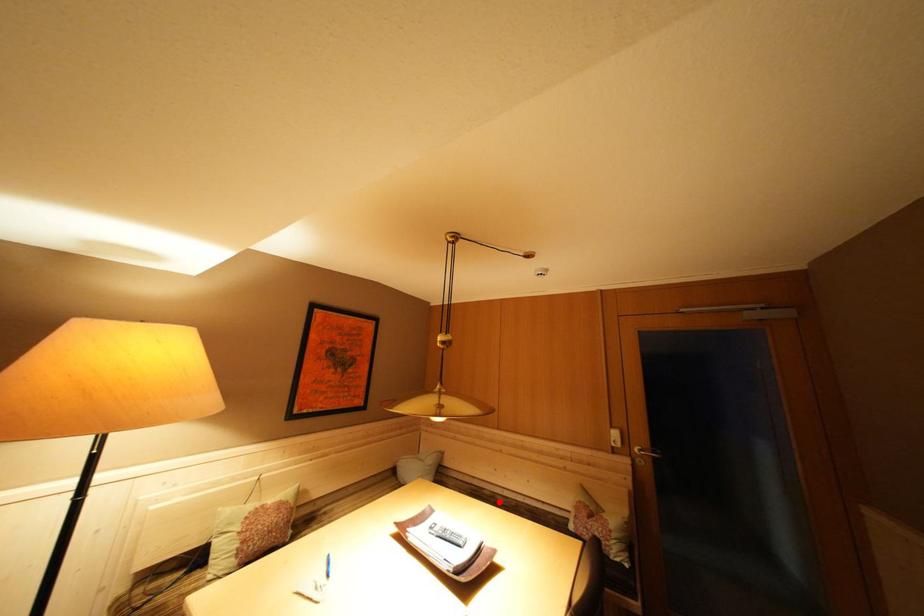
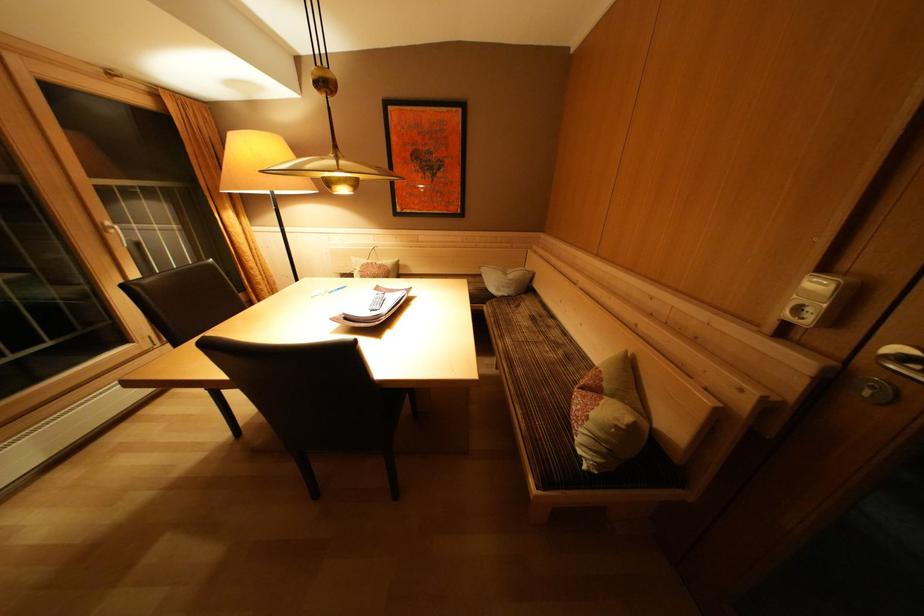
In the second image, find the point that corresponds to the highlighted location in the first image.

(555, 331)